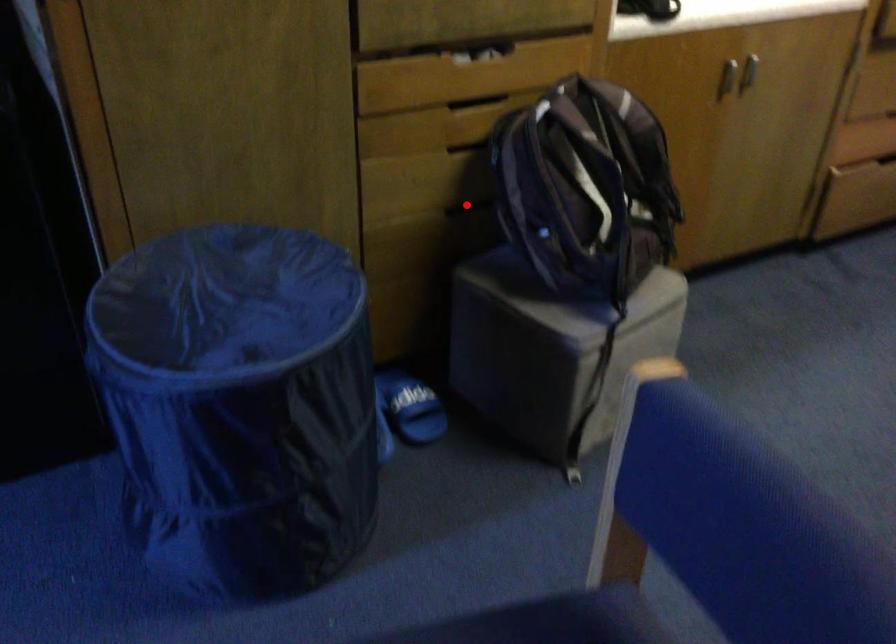
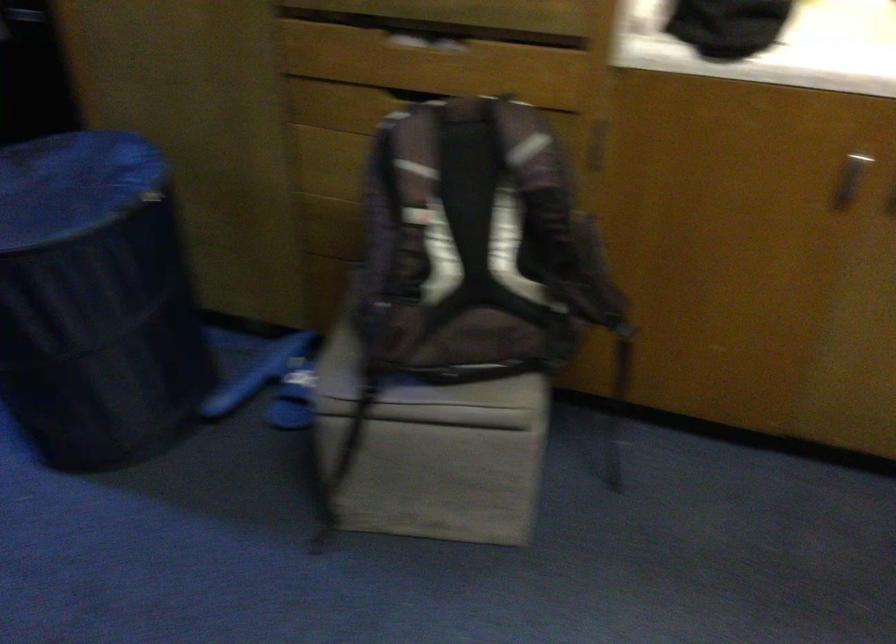
Question: I am providing you with two images of the same scene from different viewpoints. A red point is marked on the first image. Is the red point's position out of view in image 2?

Choices:
 (A) Yes
 (B) No

Answer: (A)